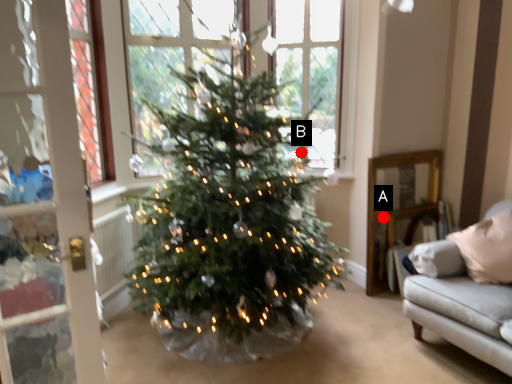
Question: Two points are circled on the image, labeled by A and B beside each circle. Which point is further to the camera?

Choices:
 (A) A is further
 (B) B is further

Answer: (A)